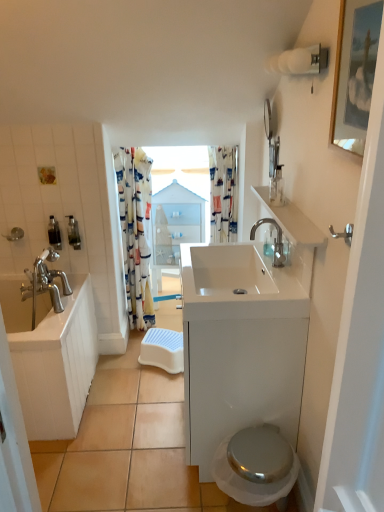
Question: Considering the positions of clear glass jar at upper right, acting as the third toiletry starting from the left, and white glossy bathtub at left in the image, is clear glass jar at upper right, acting as the third toiletry starting from the left, wider or thinner than white glossy bathtub at left?

Choices:
 (A) wide
 (B) thin

Answer: (B)

Question: Relative to white glossy bathtub at left, is clear glass jar at upper right, marked as the first toiletry in a front-to-back arrangement, in front or behind?

Choices:
 (A) front
 (B) behind

Answer: (A)

Question: Based on their relative distances, which object is farther from the clear glass jar at upper right, the 3th toiletry viewed from the back?

Choices:
 (A) satin nickel faucet at upper right
 (B) printed fabric shower curtain at center, which is the first shower curtain from right to left
 (C) white glossy medicine cabinet at center
 (D) wooden framed picture at upper right
 (E) white glossy sink at center

Answer: (C)

Question: Which object is the closest to the white glossy sink at upper right?

Choices:
 (A) metallic silver toilet at lower right
 (B) printed fabric shower curtain at center, which is the first shower curtain from right to left
 (C) glossy glass mirror at upper right
 (D) wooden framed picture at upper right
 (E) metallic silver soap dispenser at left, the 1th toiletry from the back

Answer: (C)